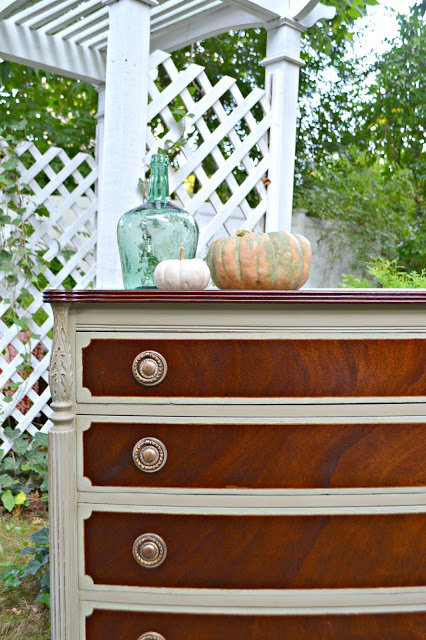
Locate an element on the screen. This screenshot has height=640, width=426. vining plant is located at coordinates (22, 226).